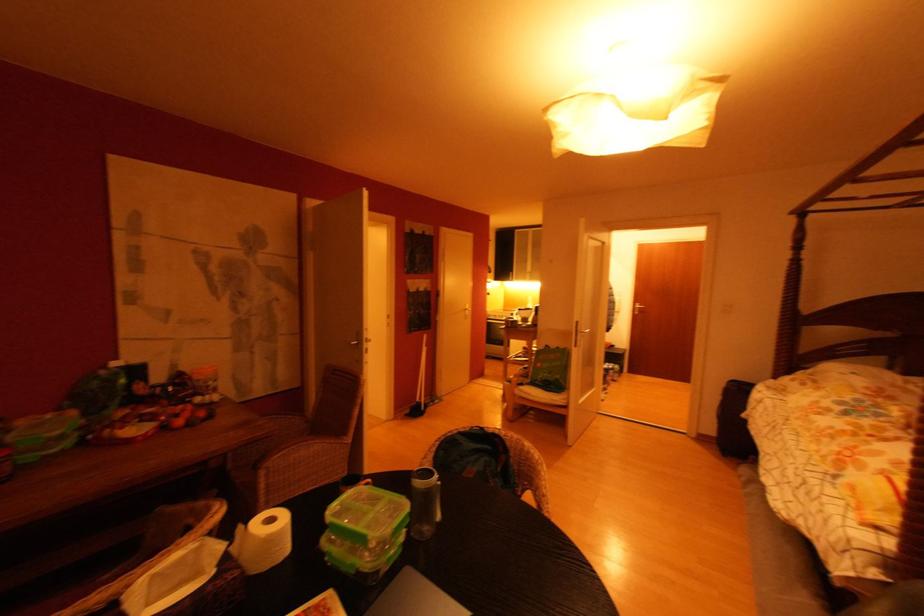
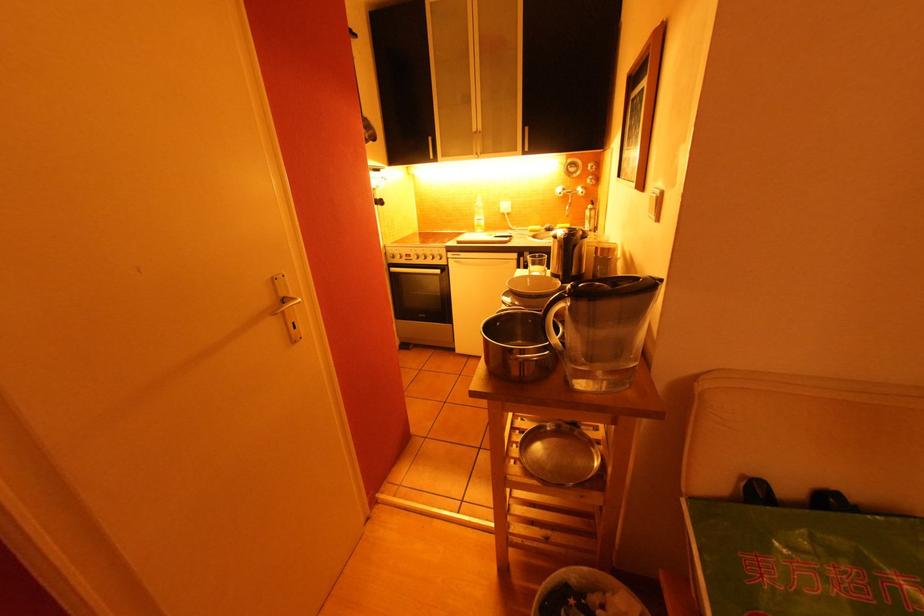
The point at (515,275) is marked in the first image. Where is the corresponding point in the second image?

(434, 140)